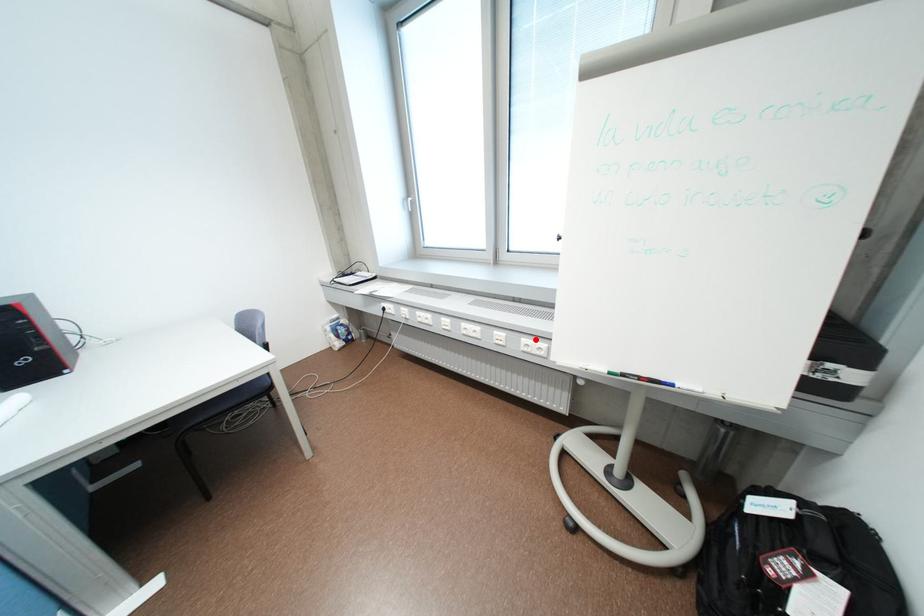
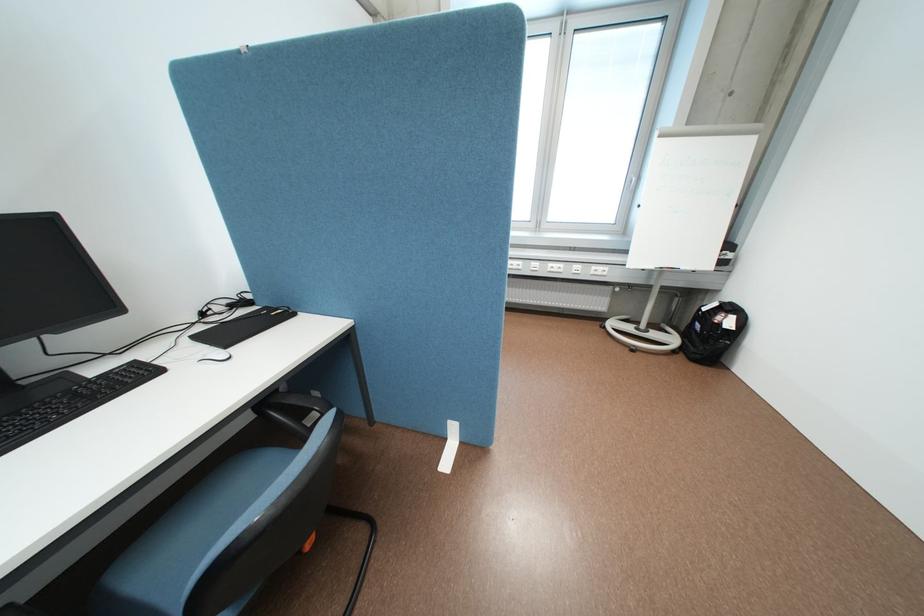
Find the pixel in the second image that matches the highlighted location in the first image.

(604, 267)